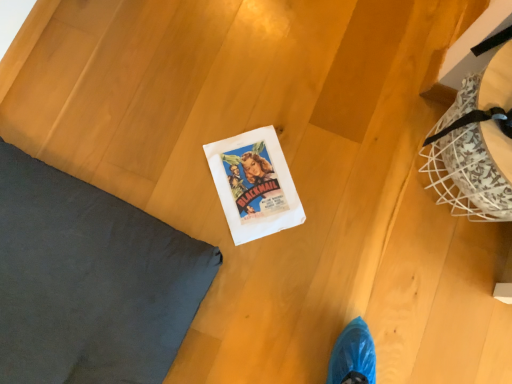
Locate an element on the screen. The height and width of the screenshot is (384, 512). free point in front of white paper comic book at center is located at coordinates (220, 224).